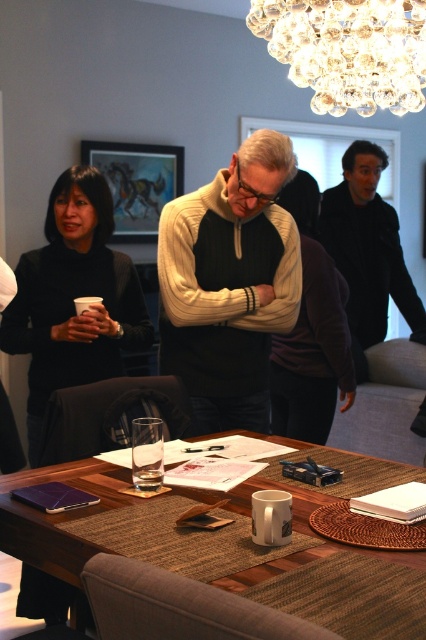
Question: Estimate the real-world distances between objects in this image. Which object is farther from the clear crystal chandelier at upper center?

Choices:
 (A) white knit sweater at center
 (B) black matte sweater at left
 (C) black matte jacket at upper right

Answer: (C)

Question: Can you confirm if black matte sweater at left is thinner than black matte jacket at upper right?

Choices:
 (A) yes
 (B) no

Answer: (A)

Question: Which object is closer to the camera taking this photo?

Choices:
 (A) wooden table at center
 (B) black matte jacket at upper right
 (C) black matte sweater at left

Answer: (A)

Question: Which object is the closest to the clear crystal chandelier at upper center?

Choices:
 (A) black matte sweater at left
 (B) white knit sweater at center

Answer: (B)

Question: Is white knit sweater at center wider than wooden table at center?

Choices:
 (A) yes
 (B) no

Answer: (B)

Question: Is white knit sweater at center positioned behind clear crystal chandelier at upper center?

Choices:
 (A) no
 (B) yes

Answer: (B)